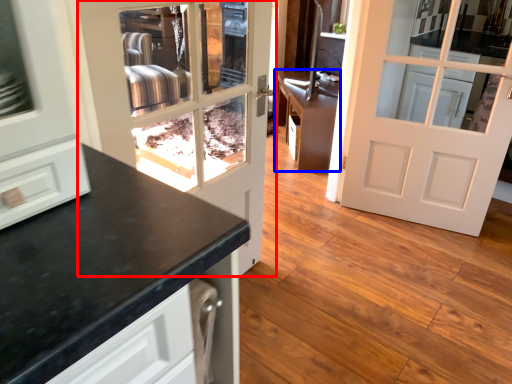
Question: Which point is closer to the camera, door (highlighted by a red box) or cabinetry (highlighted by a blue box)?

Choices:
 (A) door
 (B) cabinetry

Answer: (A)